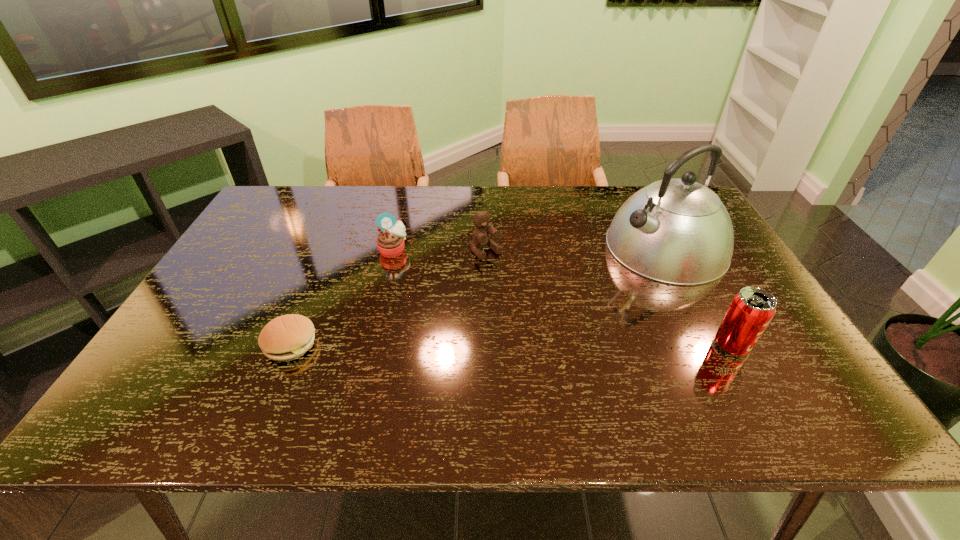
Locate an element on the screen. The image size is (960, 540). free spot between the leftmost object and the muffin is located at coordinates (342, 298).

The image size is (960, 540). I want to click on vacant point located between the kettle and the fourth object from right to left, so pos(530,248).

Where is `unoccupied position between the second object from left to right and the kettle`? This screenshot has width=960, height=540. unoccupied position between the second object from left to right and the kettle is located at coordinates (530, 248).

Identify the location of vacant space that is in between the fourth object from right to left and the tallest object. This screenshot has height=540, width=960. (530, 248).

In order to click on free point between the leftmost object and the muffin in this screenshot , I will do `click(342, 298)`.

This screenshot has width=960, height=540. What are the coordinates of `free spot between the patty and the teddy bear` in the screenshot? It's located at (389, 298).

Where is `vacant area that lies between the leftmost object and the third object from left to right`? Image resolution: width=960 pixels, height=540 pixels. vacant area that lies between the leftmost object and the third object from left to right is located at coordinates (389, 298).

Locate an element on the screen. vacant area that lies between the teddy bear and the kettle is located at coordinates (576, 249).

This screenshot has width=960, height=540. What are the coordinates of `vacant area that lies between the second object from left to right and the third object from right to left` in the screenshot? It's located at tap(440, 251).

Where is `free space between the shortest object and the fourth shortest object`? The height and width of the screenshot is (540, 960). free space between the shortest object and the fourth shortest object is located at coordinates (512, 345).